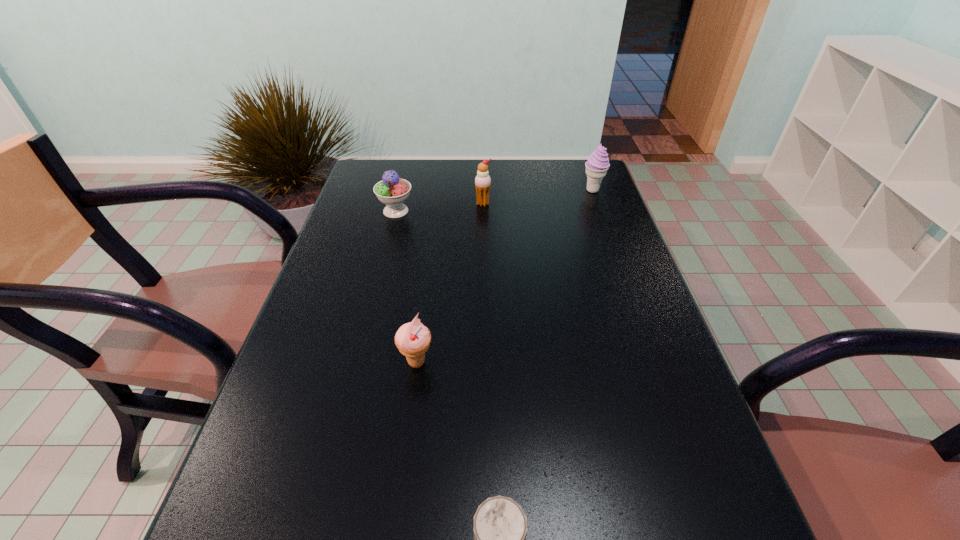
Where is `object that is at the far edge`? object that is at the far edge is located at coordinates (597, 165).

Identify the location of object present at the left edge. (392, 191).

This screenshot has height=540, width=960. Find the location of `object at the right edge`. object at the right edge is located at coordinates (x=597, y=165).

Where is `object located at the far right corner`? object located at the far right corner is located at coordinates [597, 165].

The height and width of the screenshot is (540, 960). Identify the location of vacant space at the far edge. (419, 176).

In the image, there is a desktop. Identify the location of vacant space at the right edge. (598, 339).

Find the location of a particular element. free space that is in between the farthest icecream and the third icecream from left to right is located at coordinates (538, 197).

Find the location of a particular element. free space between the rightmost icecream and the third icecream from left to right is located at coordinates (538, 197).

What are the coordinates of `vacant space in between the second icecream from right to left and the farthest icecream` in the screenshot? It's located at (538, 197).

Identify the location of vacant area between the leftmost icecream and the second icecream from right to left. The height and width of the screenshot is (540, 960). (440, 207).